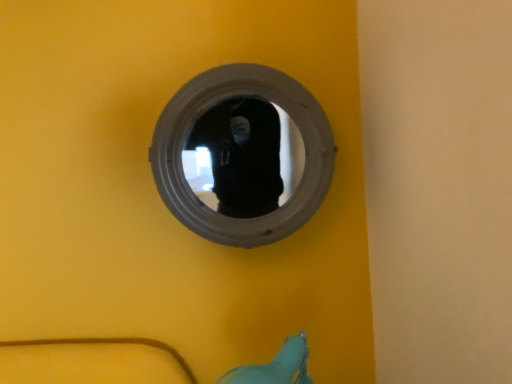
Identify the location of matte gray mirror at center. The image size is (512, 384). (207, 109).

Image resolution: width=512 pixels, height=384 pixels. What do you see at coordinates (207, 109) in the screenshot? I see `matte gray mirror at center` at bounding box center [207, 109].

Measure the distance between point [331,147] and camera.

Point [331,147] and camera are 36.22 inches apart from each other.

At what (x,y) coordinates should I click in order to perform the action: click on matte gray mirror at center. Please return your answer as a coordinate pair (x, y). This screenshot has width=512, height=384. Looking at the image, I should click on (207, 109).